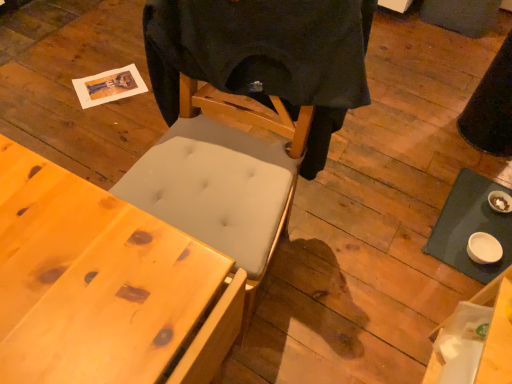
Question: Is point (484, 223) closer or farther from the camera than point (304, 66)?

Choices:
 (A) closer
 (B) farther

Answer: (B)

Question: From the image's perspective, is white matte table at lower right located above or below black matte t-shirt at center?

Choices:
 (A) above
 (B) below

Answer: (B)

Question: Which object is the farthest from the white matte table at lower right?

Choices:
 (A) wooden desk at lower left
 (B) black matte t-shirt at center

Answer: (A)

Question: Estimate the real-world distances between objects in this image. Which object is farther from the black matte t-shirt at center?

Choices:
 (A) white matte table at lower right
 (B) wooden desk at lower left

Answer: (A)